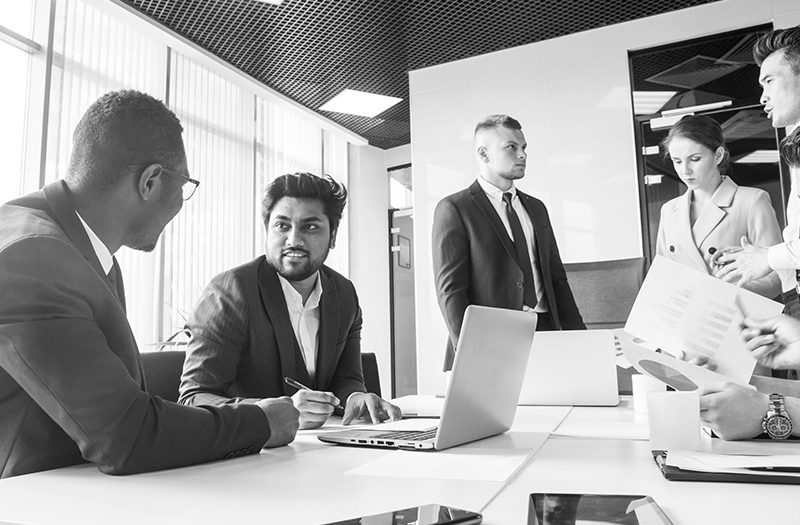
Find the location of a particular element. black ceiling is located at coordinates (364, 44).